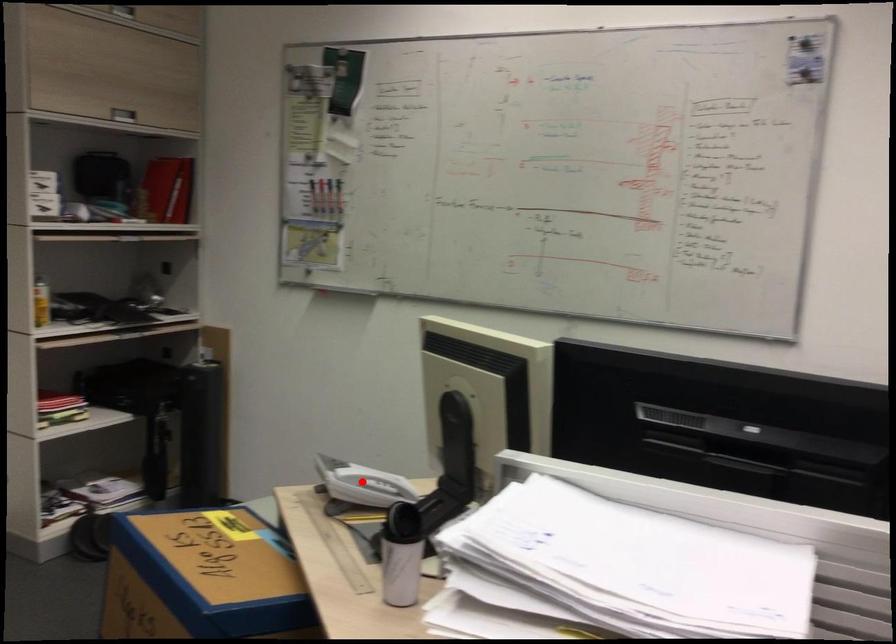
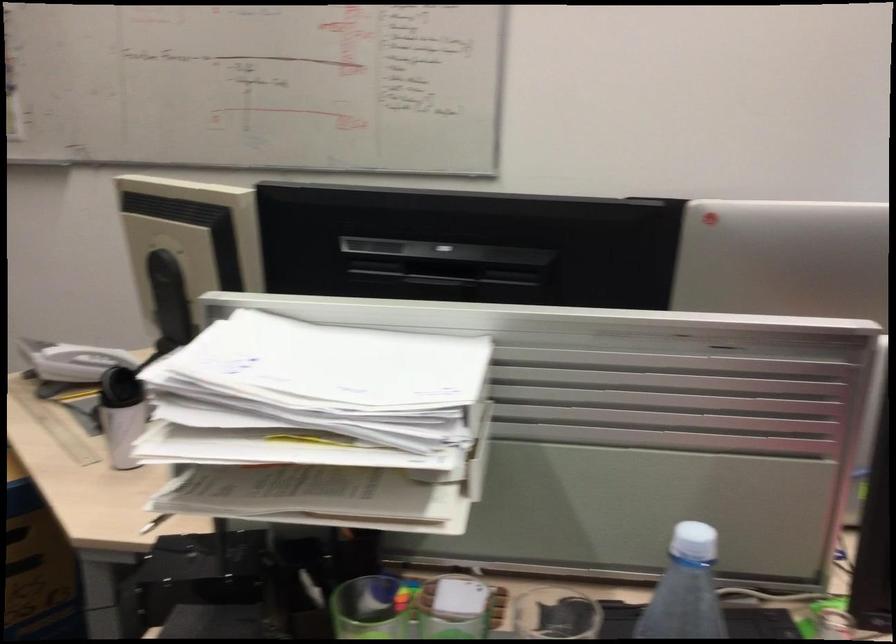
Where in the second image is the point corresponding to the highlighted location from the first image?

(82, 362)